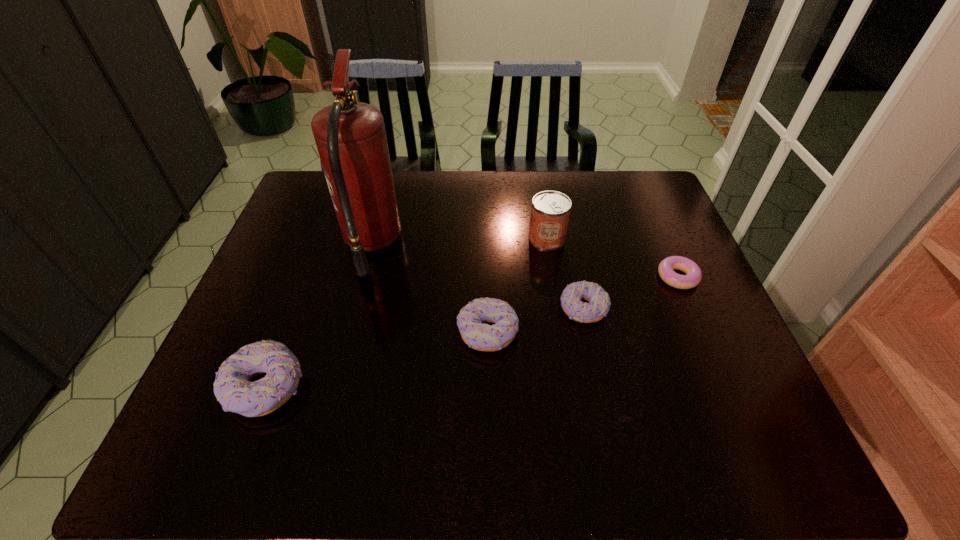
Where is `vacant space at the far edge of the desktop`? This screenshot has height=540, width=960. vacant space at the far edge of the desktop is located at coordinates (402, 205).

Find the location of a particular element. vacant space at the near edge of the desktop is located at coordinates (655, 382).

In the image, there is a desktop. At what (x,y) coordinates should I click in order to perform the action: click on blank space at the left edge. Please return your answer as a coordinate pair (x, y). Image resolution: width=960 pixels, height=540 pixels. Looking at the image, I should click on coord(270,314).

The width and height of the screenshot is (960, 540). In the image, there is a desktop. Find the location of `free space at the right edge`. free space at the right edge is located at coordinates click(664, 289).

Identify the location of vacant space at the near right corner. The height and width of the screenshot is (540, 960). [x=693, y=402].

Where is `blank region between the leftmost doughnut and the can`? This screenshot has height=540, width=960. blank region between the leftmost doughnut and the can is located at coordinates (406, 313).

Identify the location of free space that is in between the leftmost doughnut and the second doughnut from right to left. (424, 348).

Locate an element on the screen. This screenshot has width=960, height=540. vacant area that lies between the leftmost doughnut and the second tallest object is located at coordinates (406, 313).

The image size is (960, 540). I want to click on free space between the second tallest object and the leftmost doughnut, so click(406, 313).

The height and width of the screenshot is (540, 960). I want to click on vacant area that lies between the can and the third doughnut from right to left, so click(x=517, y=285).